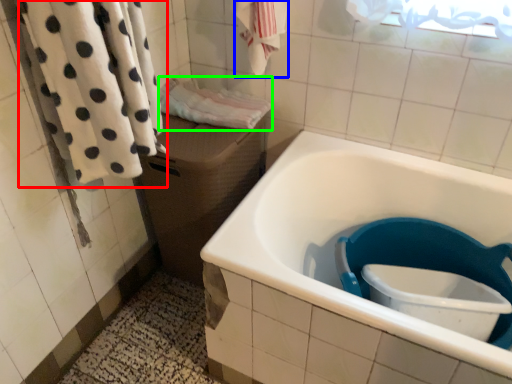
Question: Which object is the closest to the bath towel (highlighted by a red box)? Choose among these: bath towel (highlighted by a blue box) or bath towel (highlighted by a green box).

Choices:
 (A) bath towel
 (B) bath towel

Answer: (B)